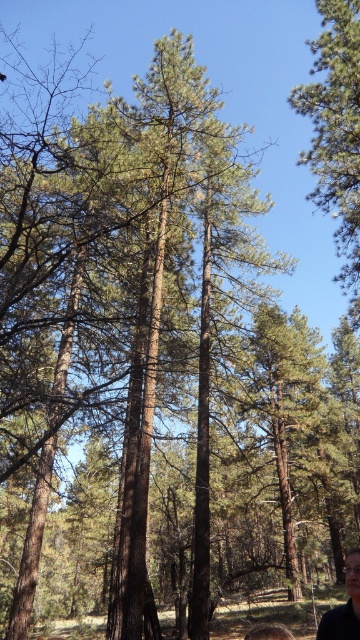
Does green needle-like at upper center have a smaller size compared to blonde hair at lower right?

Yes.

Is point (357, 74) positioned in front of point (258, 637)?

No, it is behind (258, 637).

Who is more forward, [353,300] or [277,636]?

Positioned in front is point [277,636].

Locate an element on the screen. The height and width of the screenshot is (640, 360). green needle-like at upper center is located at coordinates (335, 131).

Does dark brown hair at lower right have a lesser width compared to blonde hair at lower right?

Yes, dark brown hair at lower right is thinner than blonde hair at lower right.

Between dark brown hair at lower right and blonde hair at lower right, which one appears on the left side from the viewer's perspective?

dark brown hair at lower right is more to the left.

Describe the element at coordinates (344, 605) in the screenshot. This screenshot has height=640, width=360. I see `dark brown hair at lower right` at that location.

Locate an element on the screen. dark brown hair at lower right is located at coordinates (344, 605).

Can you confirm if green needle-like at upper center is taller than dark brown hair at lower right?

Indeed, green needle-like at upper center has a greater height compared to dark brown hair at lower right.

Who is taller, green needle-like at upper center or dark brown hair at lower right?

green needle-like at upper center

The height and width of the screenshot is (640, 360). What do you see at coordinates (335, 131) in the screenshot? I see `green needle-like at upper center` at bounding box center [335, 131].

Locate an element on the screen. The width and height of the screenshot is (360, 640). green needle-like at upper center is located at coordinates (335, 131).